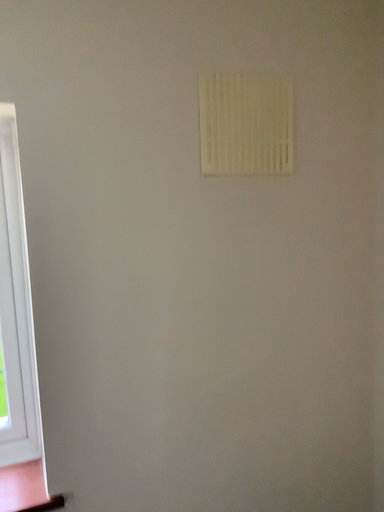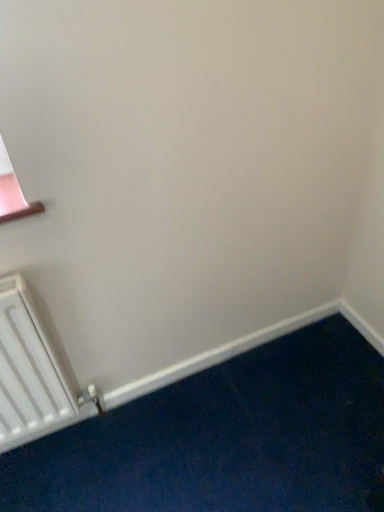
Question: How did the camera likely rotate when shooting the video?

Choices:
 (A) rotated downward
 (B) rotated upward

Answer: (A)